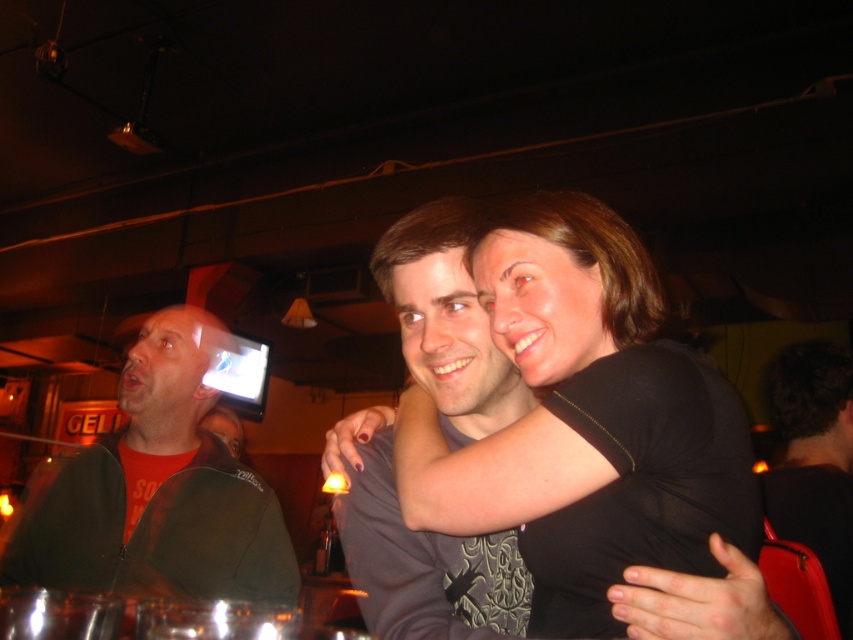
You are standing in the bar and want to take a photo of the black matte shirt at center. Where should you aim your camera to capture it?

You should aim your camera at the coordinates point (585,440) to capture the black matte shirt at center.

You are a photographer standing in the middle of the room. You want to take a photo of both the black matte shirt at center and the orange matte shirt at left. Can you fit both subjects into the frame of your camera, which has a maximum width of 30 inches?

The black matte shirt at center and orange matte shirt at left are 29.21 inches apart, so yes, both subjects can fit into the camera frame since the distance between them is less than the maximum width of 30 inches.